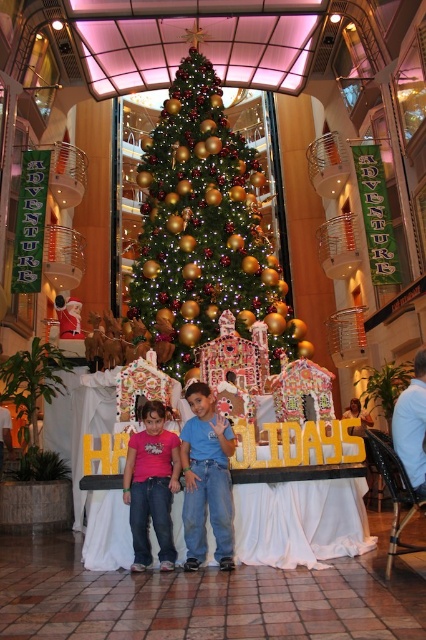
You are standing in the shopping mall and want to take a photo of the green matte christmas tree at center. If you are 44.56 meters away from it, is this distance too far to capture the entire tree in your photo?

The green matte christmas tree at center is 44.56 meters away from the camera. This distance may be too far to capture the entire tree in a single photo without using a wide angle lens or moving closer.

Based on the photo, you are standing at the entrance of the mall and see the festive display with a Christmas tree and gingerbread houses. There is a point marked at coordinates [206,480]. What object is located at that point?

The point at coordinates [206,480] corresponds to the blue cotton shirt at center.

You are a photographer taking a picture of the green matte christmas tree at center and the blue cotton shirt at center. Which object should you focus on first if you want to capture both in the frame without moving the camera?

The green matte christmas tree at center is taller than the blue cotton shirt at center, so you should focus on the green matte christmas tree at center first to ensure it fits entirely within the frame.